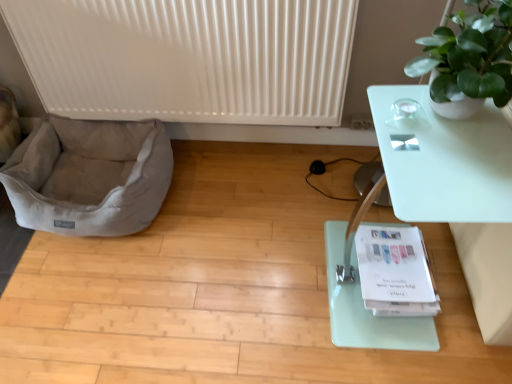
Identify the location of vacant area in front of green matte plant at upper right. The height and width of the screenshot is (384, 512). (455, 176).